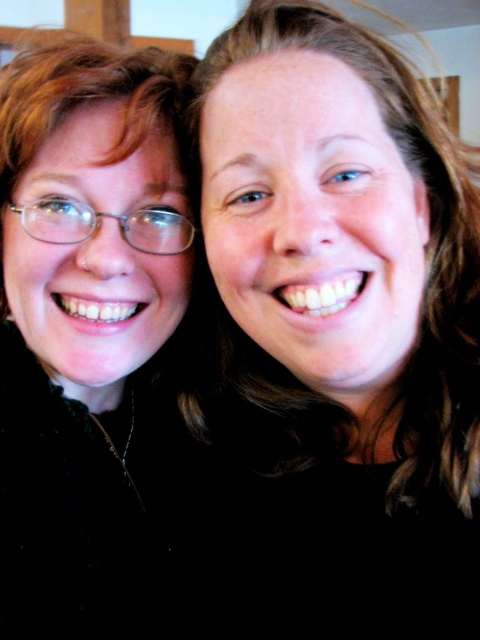
You are a photographer trying to adjust the lighting for a photo shoot. You notice a point at coordinates (342, 328) in the image. What is the object located at this point?

The point at coordinates (342, 328) indicates matte black hair at center.

You are a photographer adjusting the focus of a camera. The camera has a focus point at coordinates 0.514, 0.713. Which object in the scene should you focus on to capture the matte black hair at center clearly?

The matte black hair at center is located at point (x=342, y=328), so you should focus on the matte black hair at center to capture it clearly.

You are a photographer adjusting the framing of a portrait. You notice the matte black hair at center and the matte black glasses at left in your viewfinder. Which object should you adjust to ensure both fit comfortably within the frame without overlapping?

The matte black hair at center is wider than the matte black glasses at left. To ensure both fit comfortably without overlapping, adjust the framing so that the wider matte black hair at center has enough space, possibly by zooming out slightly or repositioning the camera angle.